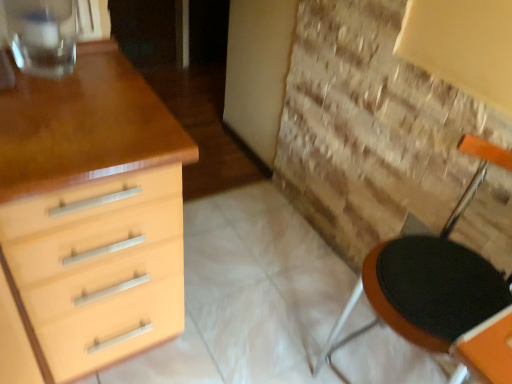
The width and height of the screenshot is (512, 384). Find the location of `free space underneath transparent glass at upper left (from a real-world perspective)`. free space underneath transparent glass at upper left (from a real-world perspective) is located at coordinates (49, 66).